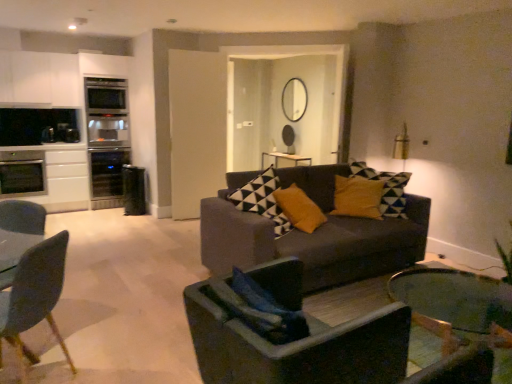
Question: Is satin black oven at left, the first appliance in the right-to-left sequence, bigger than white matte cabinet at upper left?

Choices:
 (A) no
 (B) yes

Answer: (B)

Question: Is white matte cabinet at upper left at the back of satin black oven at left, which is the third appliance from left to right?

Choices:
 (A) yes
 (B) no

Answer: (B)

Question: From the image's perspective, is satin black oven at left, the first appliance in the right-to-left sequence, under white matte cabinet at upper left?

Choices:
 (A) yes
 (B) no

Answer: (A)

Question: Is satin black oven at left, the first appliance in the right-to-left sequence, thinner than white matte cabinet at upper left?

Choices:
 (A) yes
 (B) no

Answer: (B)

Question: Is satin black oven at left, the first appliance in the right-to-left sequence, in contact with white matte cabinet at upper left?

Choices:
 (A) no
 (B) yes

Answer: (A)

Question: Looking at their shapes, would you say black glass wine cooler at left, arranged as the second appliance when viewed from the right, is wider or thinner than satin silver oven at left, marked as the first appliance in a left-to-right arrangement?

Choices:
 (A) wide
 (B) thin

Answer: (B)

Question: From a real-world perspective, is black glass wine cooler at left, arranged as the second appliance when viewed from the right, above or below satin silver oven at left, marked as the first appliance in a left-to-right arrangement?

Choices:
 (A) below
 (B) above

Answer: (A)

Question: From the image's perspective, relative to satin silver oven at left, marked as the first appliance in a left-to-right arrangement, is black glass wine cooler at left, arranged as the second appliance when viewed from the right, above or below?

Choices:
 (A) above
 (B) below

Answer: (B)

Question: Considering the positions of point (129, 162) and point (20, 175), is point (129, 162) closer or farther from the camera than point (20, 175)?

Choices:
 (A) closer
 (B) farther

Answer: (B)

Question: Would you say matte gray couch at center is to the left or to the right of matte gray chair at left, the second chair viewed from the right, in the picture?

Choices:
 (A) left
 (B) right

Answer: (B)

Question: From a real-world perspective, is matte gray couch at center positioned above or below matte gray chair at left, the first chair positioned from the left?

Choices:
 (A) above
 (B) below

Answer: (A)

Question: Is matte gray couch at center taller or shorter than matte gray chair at left, the second chair viewed from the right?

Choices:
 (A) tall
 (B) short

Answer: (A)

Question: Based on their sizes in the image, would you say matte gray couch at center is bigger or smaller than matte gray chair at left, the second chair viewed from the right?

Choices:
 (A) big
 (B) small

Answer: (A)

Question: In terms of height, does matte gray chair at left, the second chair viewed from the right, look taller or shorter compared to dark gray fabric chair at center, which appears as the 2th chair when viewed from the left?

Choices:
 (A) short
 (B) tall

Answer: (B)

Question: In the image, is matte gray chair at left, the second chair viewed from the right, positioned in front of or behind dark gray fabric chair at center, which appears as the 2th chair when viewed from the left?

Choices:
 (A) front
 (B) behind

Answer: (B)